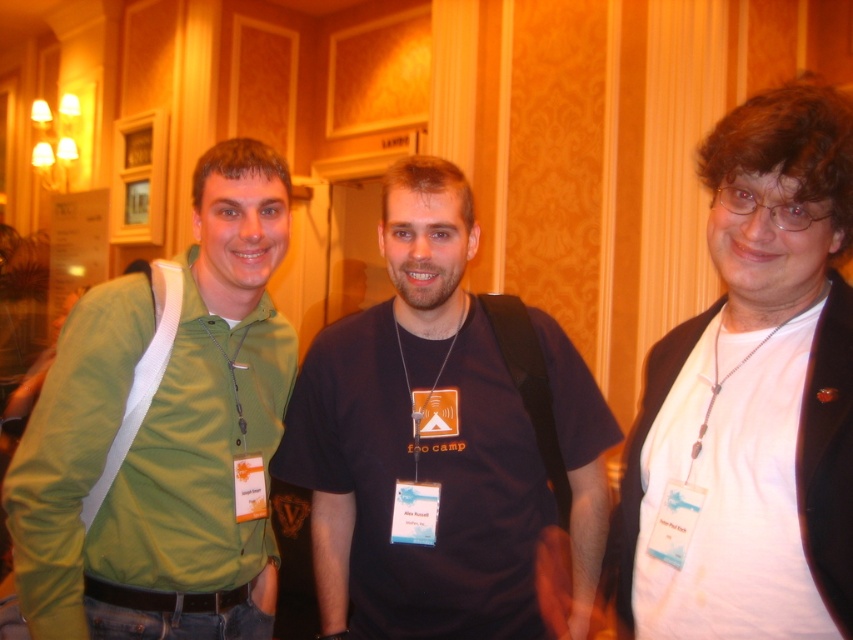
Question: Can you confirm if dark blue t-shirt at center is positioned to the left of green fabric shirt at left?

Choices:
 (A) no
 (B) yes

Answer: (A)

Question: Which object appears farthest from the camera in this image?

Choices:
 (A) white matte shirt at right
 (B) green fabric shirt at left

Answer: (B)

Question: Can you confirm if dark blue t-shirt at center is positioned to the right of green fabric shirt at left?

Choices:
 (A) yes
 (B) no

Answer: (A)

Question: Which point is farther from the camera taking this photo?

Choices:
 (A) (369, 625)
 (B) (843, 314)

Answer: (A)

Question: Is green fabric shirt at left in front of white matte shirt at right?

Choices:
 (A) yes
 (B) no

Answer: (B)

Question: Which of the following is the farthest from the observer?

Choices:
 (A) (178, 384)
 (B) (801, 486)

Answer: (A)